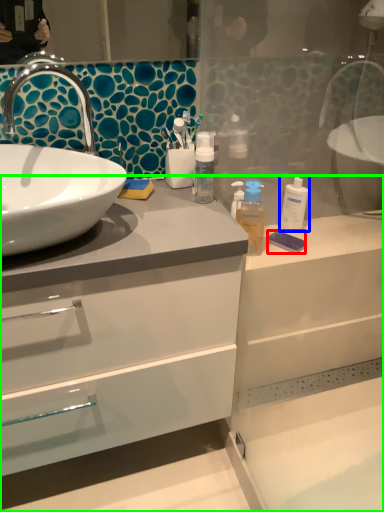
Question: Which object is the farthest from soap (highlighted by a red box)? Choose among these: mouthwash (highlighted by a blue box) or bathroom cabinet (highlighted by a green box).

Choices:
 (A) mouthwash
 (B) bathroom cabinet

Answer: (B)